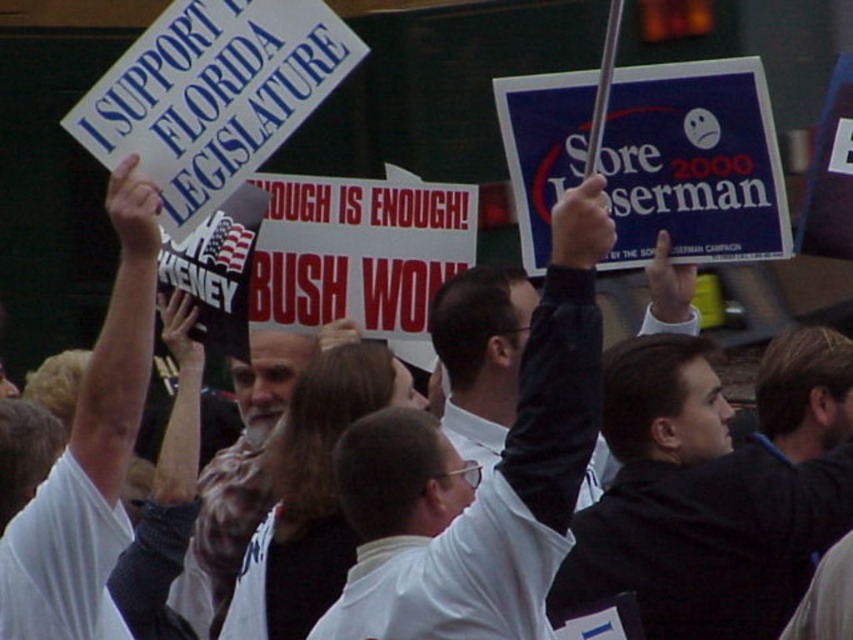
Question: Can you confirm if white matte shirt at center is smaller than black matte jacket at upper right?

Choices:
 (A) yes
 (B) no

Answer: (B)

Question: Based on their relative distances, which object is nearer to the black matte jacket at upper right?

Choices:
 (A) white matte shirt at center
 (B) white matte shirt at upper left

Answer: (A)

Question: Is black matte jacket at upper right smaller than white matte shirt at upper left?

Choices:
 (A) yes
 (B) no

Answer: (B)

Question: Which of these objects is positioned closest to the white matte shirt at upper left?

Choices:
 (A) black matte jacket at upper right
 (B) white matte shirt at center

Answer: (B)

Question: Estimate the real-world distances between objects in this image. Which object is closer to the white matte shirt at center?

Choices:
 (A) white matte shirt at upper left
 (B) black matte jacket at upper right

Answer: (B)

Question: Can you confirm if white matte shirt at center is positioned to the left of black matte jacket at upper right?

Choices:
 (A) yes
 (B) no

Answer: (A)